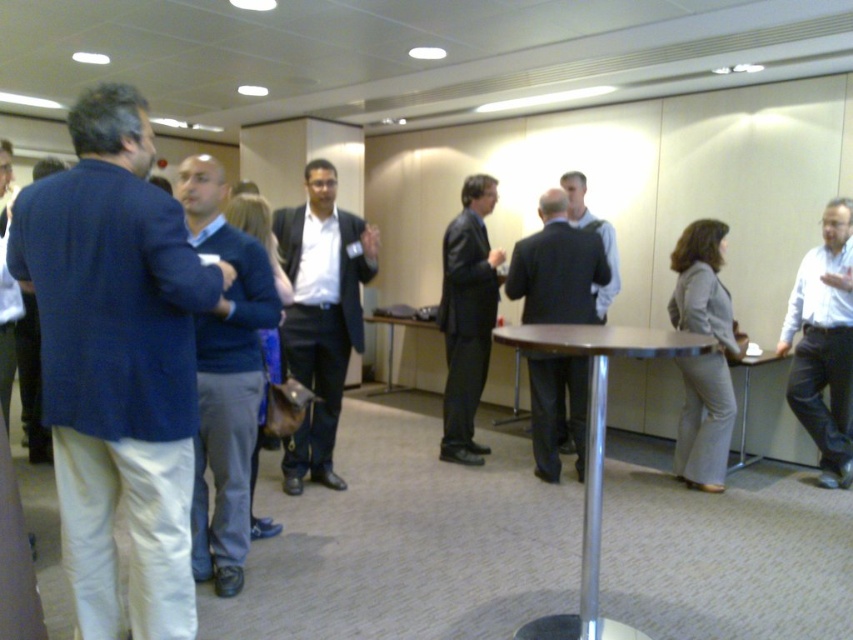
Question: Which point appears closest to the camera in this image?

Choices:
 (A) (479, 369)
 (B) (90, 138)

Answer: (B)

Question: From the image, what is the correct spatial relationship of gray fabric suit at right in relation to wooden table at center?

Choices:
 (A) above
 (B) below

Answer: (B)

Question: Is gray fabric suit at right to the left of metallic polished table at center from the viewer's perspective?

Choices:
 (A) yes
 (B) no

Answer: (B)

Question: Can you confirm if wooden table at center is smaller than metallic silver table at center?

Choices:
 (A) yes
 (B) no

Answer: (B)

Question: Estimate the real-world distances between objects in this image. Which object is closer to the dark blue sweater at left?

Choices:
 (A) matte black suit at center
 (B) metallic polished table at center
 (C) dark suit at center

Answer: (B)

Question: Among these points, which one is farthest from the camera?

Choices:
 (A) (242, 276)
 (B) (793, 320)
 (C) (374, 253)
 (D) (780, 355)

Answer: (D)